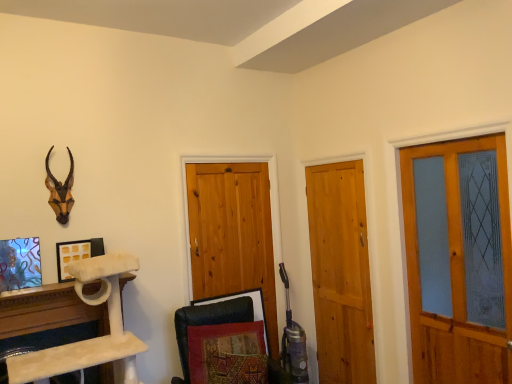
At what (x,y) coordinates should I click in order to perform the action: click on empty space that is ontop of natural wood barn door at center, the 2th barn door positioned from the right. Please return your answer as a coordinate pair (x, y). This screenshot has width=512, height=384. Looking at the image, I should click on (228, 160).